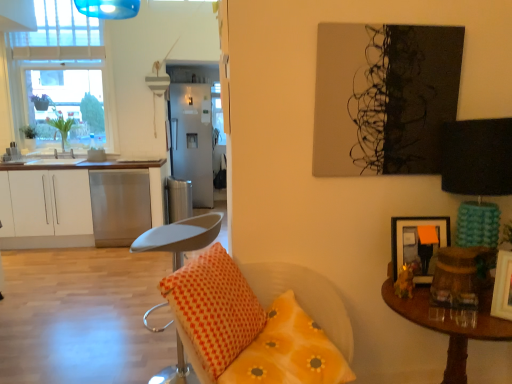
What do you see at coordinates (289, 351) in the screenshot? The image size is (512, 384). I see `orange dotted pillow at lower center, which is the second pillow from left to right` at bounding box center [289, 351].

Locate an element on the screen. The image size is (512, 384). green leafy plant at left, marked as the second houseplant in a right-to-left arrangement is located at coordinates [29, 137].

What do you see at coordinates (503, 287) in the screenshot? Image resolution: width=512 pixels, height=384 pixels. I see `wooden picture frame at right, the second picture frame positioned from the back` at bounding box center [503, 287].

This screenshot has width=512, height=384. Find the location of `satin silver trash can at center`. satin silver trash can at center is located at coordinates (179, 199).

Where is `orange dotted pillow at lower center, which is the second pillow from left to right`? orange dotted pillow at lower center, which is the second pillow from left to right is located at coordinates (289, 351).

Is point (472, 241) closer or farther from the camera than point (32, 137)?

Point (472, 241).

From the picture: Which object is thinner, teal fabric lampshade at right or green leafy plant at left, marked as the second houseplant in a right-to-left arrangement?

green leafy plant at left, marked as the second houseplant in a right-to-left arrangement.

Does teal fabric lampshade at right have a larger size compared to green leafy plant at left, marked as the second houseplant in a right-to-left arrangement?

Yes, teal fabric lampshade at right is bigger than green leafy plant at left, marked as the second houseplant in a right-to-left arrangement.

How far apart are teal fabric lampshade at right and green leafy plant at left, which ranks as the 1th houseplant in left-to-right order?

teal fabric lampshade at right is 4.82 meters away from green leafy plant at left, which ranks as the 1th houseplant in left-to-right order.

What's the angular difference between wooden picture frame at right, positioned as the 2th picture frame in left-to-right order, and orange matte picture frame at upper right, which appears as the first picture frame when viewed from the back,'s facing directions?

The angle between the facing direction of wooden picture frame at right, positioned as the 2th picture frame in left-to-right order, and the facing direction of orange matte picture frame at upper right, which appears as the first picture frame when viewed from the back, is 38.2 degrees.

From the image's perspective, would you say wooden picture frame at right, the second picture frame positioned from the back, is shown under orange matte picture frame at upper right, acting as the first picture frame starting from the left?

Yes, from the image's perspective, wooden picture frame at right, the second picture frame positioned from the back, is beneath orange matte picture frame at upper right, acting as the first picture frame starting from the left.

Identify the location of picture frame above the wooden picture frame at right, the second picture frame positioned from the back (from a real-world perspective). The image size is (512, 384). (418, 244).

From a real-world perspective, is wooden picture frame at right, positioned as the 2th picture frame in left-to-right order, above or below orange matte picture frame at upper right, the second picture frame from the right?

wooden picture frame at right, positioned as the 2th picture frame in left-to-right order, is situated lower than orange matte picture frame at upper right, the second picture frame from the right, in the real world.

How different are the orientations of white matte cabinet at left and teal fabric lampshade at right in degrees?

2.11 degrees.

Is white matte cabinet at left touching teal fabric lampshade at right?

No, white matte cabinet at left is not in contact with teal fabric lampshade at right.

Between point (91, 221) and point (454, 153), which one is positioned behind?

The point (91, 221) is more distant.

Is white matte cabinet at left to the right of teal fabric lampshade at right from the viewer's perspective?

Incorrect, white matte cabinet at left is not on the right side of teal fabric lampshade at right.

Do you think satin silver refrigerator at center is within clear glass window at upper left, or outside of it?

satin silver refrigerator at center is outside clear glass window at upper left.

Can you confirm if satin silver refrigerator at center is positioned to the right of clear glass window at upper left?

Yes.

Is satin silver refrigerator at center wider than clear glass window at upper left?

Yes.

Is point (208, 187) less distant than point (53, 98)?

No, (208, 187) is further to viewer.

Considering the relative sizes of clear glass window at upper left and wooden picture frame at right, positioned as the 2th picture frame in left-to-right order, in the image provided, is clear glass window at upper left thinner than wooden picture frame at right, positioned as the 2th picture frame in left-to-right order,?

In fact, clear glass window at upper left might be wider than wooden picture frame at right, positioned as the 2th picture frame in left-to-right order.

From a real-world perspective, is clear glass window at upper left located beneath wooden picture frame at right, the second picture frame positioned from the back?

Actually, clear glass window at upper left is physically above wooden picture frame at right, the second picture frame positioned from the back, in the real world.

In the image, is clear glass window at upper left positioned in front of or behind wooden picture frame at right, positioned as the 2th picture frame in left-to-right order?

Visually, clear glass window at upper left is located behind wooden picture frame at right, positioned as the 2th picture frame in left-to-right order.

Considering the relative sizes of brown wooden table at right and orange dotted pillow at lower center, which is the second pillow from left to right, in the image provided, is brown wooden table at right thinner than orange dotted pillow at lower center, which is the second pillow from left to right,?

In fact, brown wooden table at right might be wider than orange dotted pillow at lower center, which is the second pillow from left to right.

Is brown wooden table at right inside or outside of orange dotted pillow at lower center, the first pillow when ordered from right to left?

brown wooden table at right is outside orange dotted pillow at lower center, the first pillow when ordered from right to left.

Where is `table below the orange dotted pillow at lower center, the first pillow when ordered from right to left (from the image's perspective)`? This screenshot has height=384, width=512. table below the orange dotted pillow at lower center, the first pillow when ordered from right to left (from the image's perspective) is located at coordinates (450, 324).

Is brown wooden table at right placed right next to orange dotted pillow at lower center, the first pillow when ordered from right to left?

They are not placed beside each other.

From the image's perspective, is brown wooden table at right above or below clear glass window at upper left?

brown wooden table at right is below clear glass window at upper left.

Image resolution: width=512 pixels, height=384 pixels. I want to click on table in front of the clear glass window at upper left, so click(x=450, y=324).

Is brown wooden table at right not within clear glass window at upper left?

brown wooden table at right lies outside clear glass window at upper left's area.

Is brown wooden table at right at the right side of clear glass window at upper left?

Correct, you'll find brown wooden table at right to the right of clear glass window at upper left.

Locate an element on the screen. This screenshot has height=384, width=512. lamp below the green leafy plant at left, marked as the second houseplant in a right-to-left arrangement (from a real-world perspective) is located at coordinates (477, 175).

I want to click on picture frame located behind the wooden picture frame at right, positioned as the 2th picture frame in left-to-right order, so click(x=418, y=244).

When comparing their distances from green leafy plant at left, marked as the second houseplant in a right-to-left arrangement, does satin silver trash can at center or white plastic stool at center seem further?

Among the two, white plastic stool at center is located further to green leafy plant at left, marked as the second houseplant in a right-to-left arrangement.

When comparing their distances from brown wooden table at right, does wooden picture frame at right, the 1th picture frame viewed from the front, or orange dotted pillow at center, marked as the 1th pillow in a left-to-right arrangement, seem further?

Based on the image, orange dotted pillow at center, marked as the 1th pillow in a left-to-right arrangement, appears to be further to brown wooden table at right.

Estimate the real-world distances between objects in this image. Which object is closer to satin silver trash can at center, clear glass window at upper left or brown wooden table at right?

Among the two, clear glass window at upper left is located nearer to satin silver trash can at center.

Looking at the image, which one is located closer to satin silver trash can at center, satin silver refrigerator at center or orange dotted pillow at center, the second pillow positioned from the right?

satin silver refrigerator at center lies closer to satin silver trash can at center than the other object.

Looking at the image, which one is located closer to clear glass window at upper left, wooden picture frame at right, positioned as the 2th picture frame in left-to-right order, or white plastic stool at center?

The object closer to clear glass window at upper left is white plastic stool at center.

Considering their positions, is orange dotted pillow at center, the second pillow positioned from the right, positioned further to white matte cabinet at left than orange matte picture frame at upper right, the second picture frame from the front?

orange matte picture frame at upper right, the second picture frame from the front.

From the image, which object appears to be nearer to white matte cabinet at left, orange dotted pillow at center, the second pillow positioned from the right, or green leafy plant at left, marked as the second houseplant in a right-to-left arrangement?

Based on the image, green leafy plant at left, marked as the second houseplant in a right-to-left arrangement, appears to be nearer to white matte cabinet at left.

Which object lies further to the anchor point green leafy plant at left, the first houseplant from the right, green leafy plant at left, which ranks as the 1th houseplant in left-to-right order, or wooden picture frame at right, the second picture frame positioned from the back?

Among the two, wooden picture frame at right, the second picture frame positioned from the back, is located further to green leafy plant at left, the first houseplant from the right.

You are a GUI agent. You are given a task and a screenshot of the screen. Output one action in this format:
    pyautogui.click(x=<x>, y=<y>)
    Task: Click on the window between white plastic stool at center and green leafy plant at left, marked as the second houseplant in a right-to-left arrangement, from front to back
    Image resolution: width=512 pixels, height=384 pixels.
    Given the screenshot: What is the action you would take?
    pyautogui.click(x=60, y=74)

Identify the location of window between white plastic stool at center and green leafy plant at left, the first houseplant from the right, from front to back. The height and width of the screenshot is (384, 512). (60, 74).

Identify the location of chair between wooden picture frame at right, positioned as the 2th picture frame in left-to-right order, and satin silver trash can at center in the front-back direction. (180, 236).

Identify the location of cabinetry situated between green leafy plant at left, marked as the second houseplant in a right-to-left arrangement, and wooden picture frame at right, the 1th picture frame viewed from the front, from left to right. (49, 209).